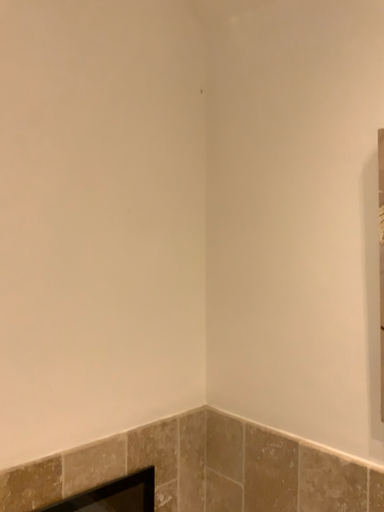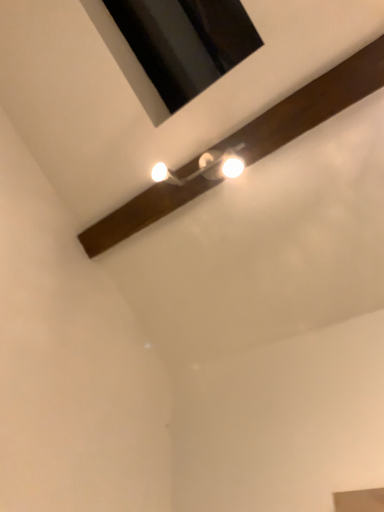
Question: Which way did the camera rotate in the video?

Choices:
 (A) rotated right
 (B) rotated left

Answer: (A)